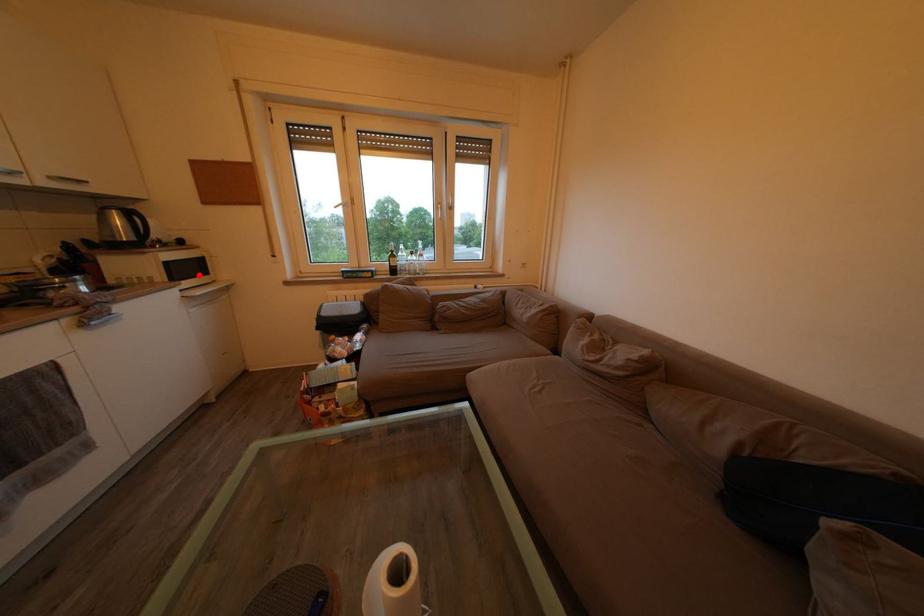
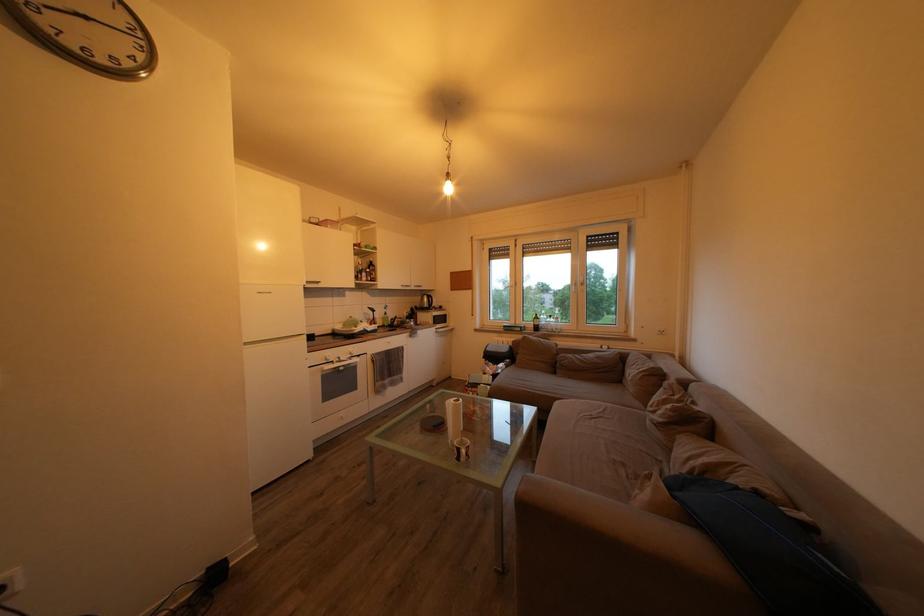
The point at the highlighted location is marked in the first image. Where is the corresponding point in the second image?

(448, 326)